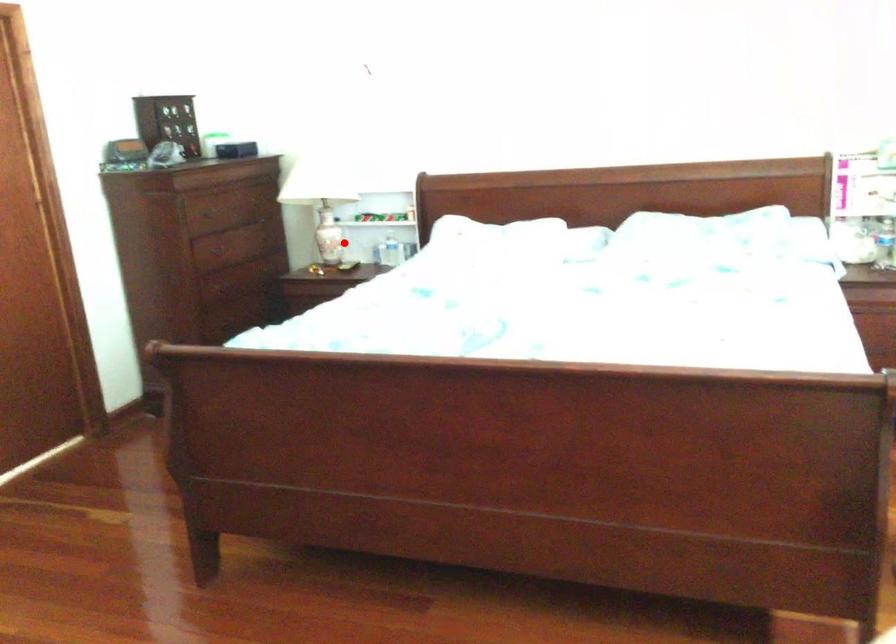
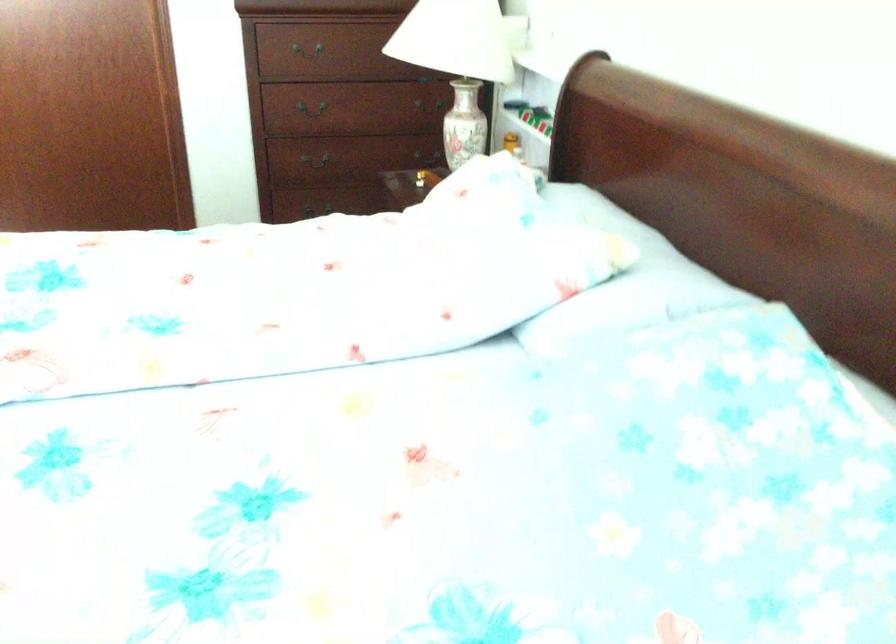
Question: I am providing you with two images of the same scene from different viewpoints. Given a red point in image1, look at the same physical point in image2. Is it:

Choices:
 (A) Closer to the viewpoint
 (B) Farther from the viewpoint

Answer: (A)